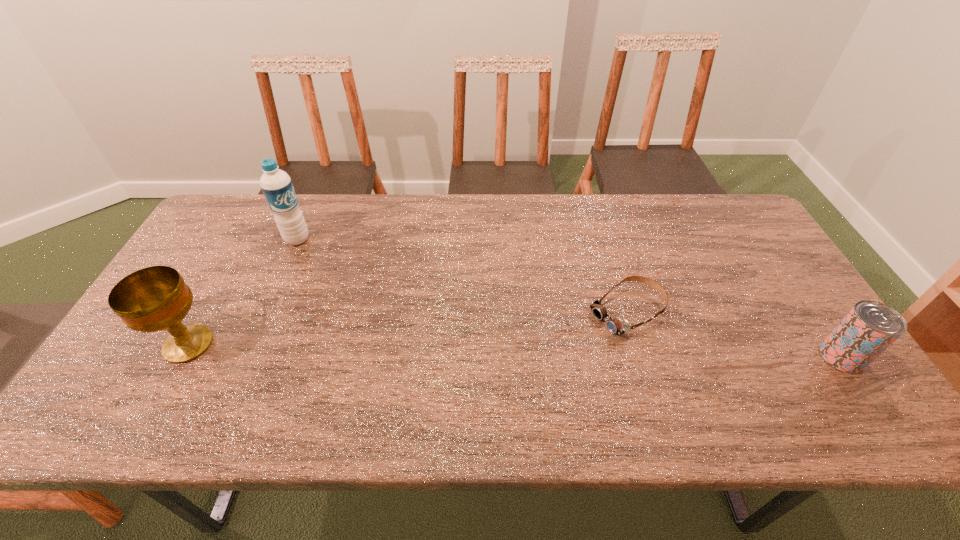
You are a GUI agent. You are given a task and a screenshot of the screen. Output one action in this format:
    pyautogui.click(x=<x>, y=<y>)
    Task: Click on the chalice
    The width and height of the screenshot is (960, 540).
    Given the screenshot: What is the action you would take?
    pyautogui.click(x=156, y=298)

Locate an element on the screen. the third shortest object is located at coordinates (156, 298).

This screenshot has height=540, width=960. I want to click on the rightmost object, so click(x=870, y=327).

Locate an element on the screen. beer can is located at coordinates (870, 327).

Locate an element on the screen. The image size is (960, 540). water bottle is located at coordinates (276, 184).

This screenshot has width=960, height=540. What are the coordinates of `the third object from right to left` in the screenshot? It's located at (276, 184).

Where is `goggles`? This screenshot has width=960, height=540. goggles is located at coordinates (615, 325).

This screenshot has height=540, width=960. Identify the location of the shortest object. (615, 325).

Locate an element on the screen. This screenshot has width=960, height=540. free space located 0.320m on the back of the chalice is located at coordinates (246, 241).

At what (x,y) coordinates should I click in order to perform the action: click on vacant point located on the left of the third tallest object. Please return your answer as a coordinate pair (x, y). The width and height of the screenshot is (960, 540). Looking at the image, I should click on (784, 356).